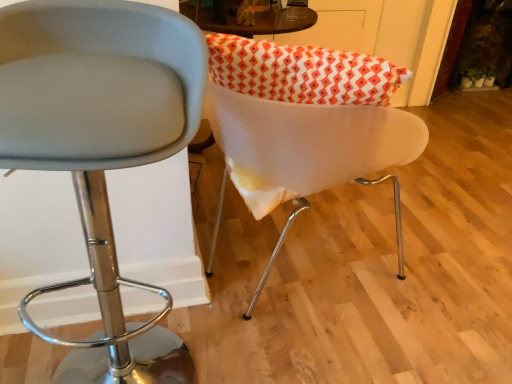
Question: Could white glossy chair at center, which ranks as the first chair in right-to-left order, be considered to be inside matte gray stool at center, which is counted as the 1th chair, starting from the left?

Choices:
 (A) yes
 (B) no

Answer: (B)

Question: Considering the relative positions of matte gray stool at center, the second chair from the right, and white glossy chair at center, which ranks as the first chair in right-to-left order, in the image provided, is matte gray stool at center, the second chair from the right, to the right of white glossy chair at center, which ranks as the first chair in right-to-left order, from the viewer's perspective?

Choices:
 (A) no
 (B) yes

Answer: (A)

Question: Considering the relative sizes of matte gray stool at center, which is counted as the 1th chair, starting from the left, and white glossy chair at center, the second chair from the left, in the image provided, is matte gray stool at center, which is counted as the 1th chair, starting from the left, thinner than white glossy chair at center, the second chair from the left,?

Choices:
 (A) yes
 (B) no

Answer: (A)

Question: Is the position of matte gray stool at center, which is counted as the 1th chair, starting from the left, more distant than that of white glossy chair at center, the second chair from the left?

Choices:
 (A) yes
 (B) no

Answer: (B)

Question: Can you confirm if matte gray stool at center, which is counted as the 1th chair, starting from the left, is smaller than white glossy chair at center, the second chair from the left?

Choices:
 (A) yes
 (B) no

Answer: (B)

Question: Is matte gray stool at center, which is counted as the 1th chair, starting from the left, bigger than white glossy chair at center, which ranks as the first chair in right-to-left order?

Choices:
 (A) yes
 (B) no

Answer: (A)

Question: Does white glossy chair at center, the second chair from the left, turn towards matte gray stool at center, the second chair from the right?

Choices:
 (A) yes
 (B) no

Answer: (B)

Question: Is white glossy chair at center, the second chair from the left, not near matte gray stool at center, the second chair from the right?

Choices:
 (A) yes
 (B) no

Answer: (B)

Question: Considering the relative sizes of white glossy chair at center, which ranks as the first chair in right-to-left order, and matte gray stool at center, the second chair from the right, in the image provided, is white glossy chair at center, which ranks as the first chair in right-to-left order, taller than matte gray stool at center, the second chair from the right,?

Choices:
 (A) yes
 (B) no

Answer: (B)

Question: Is white glossy chair at center, which ranks as the first chair in right-to-left order, to the right of matte gray stool at center, which is counted as the 1th chair, starting from the left, from the viewer's perspective?

Choices:
 (A) no
 (B) yes

Answer: (B)

Question: From the image's perspective, does white glossy chair at center, which ranks as the first chair in right-to-left order, appear lower than matte gray stool at center, which is counted as the 1th chair, starting from the left?

Choices:
 (A) yes
 (B) no

Answer: (B)

Question: Is white glossy chair at center, which ranks as the first chair in right-to-left order, wider than matte gray stool at center, the second chair from the right?

Choices:
 (A) no
 (B) yes

Answer: (B)

Question: In the image, is matte gray stool at center, the second chair from the right, positioned in front of or behind white glossy chair at center, the second chair from the left?

Choices:
 (A) front
 (B) behind

Answer: (A)